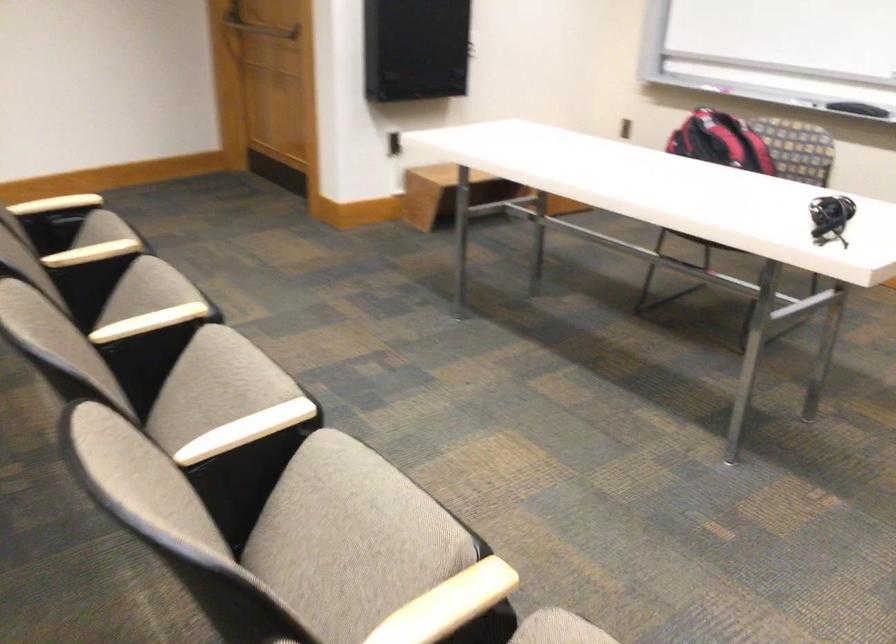
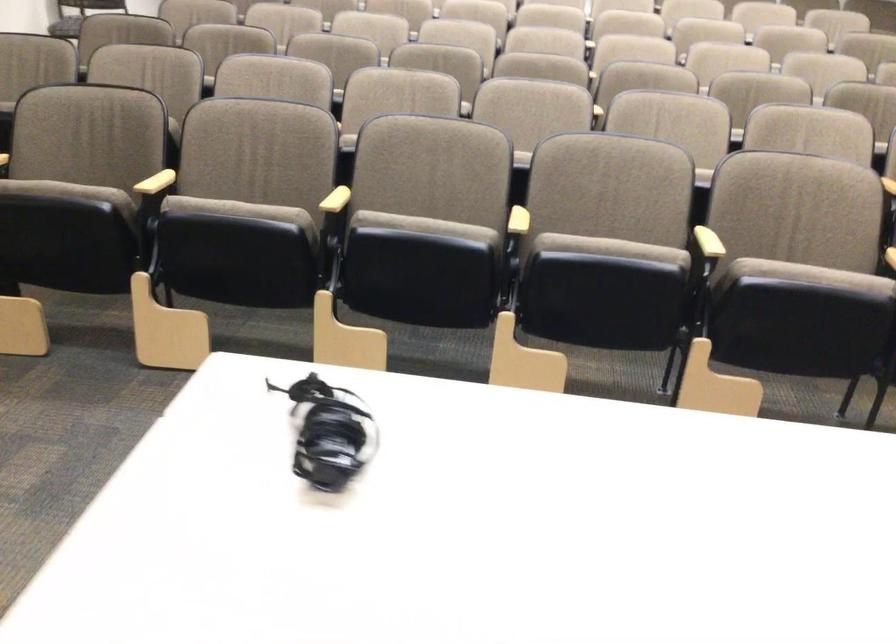
Find the pixel in the second image that matches [366,491] in the first image.

(424, 225)